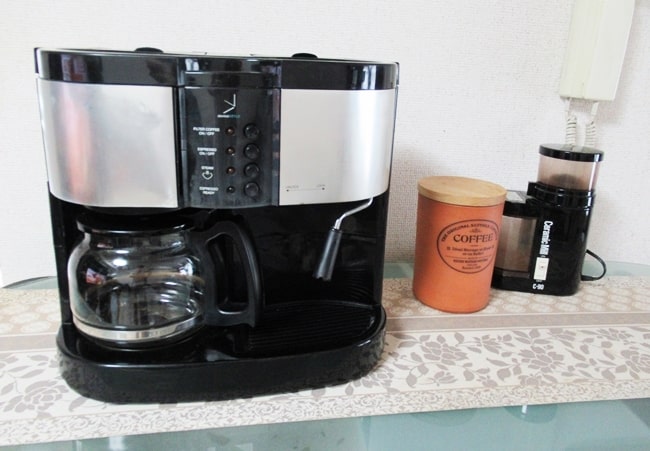
The width and height of the screenshot is (650, 451). What are the coordinates of `base of coffee pot` in the screenshot? It's located at (145, 350).